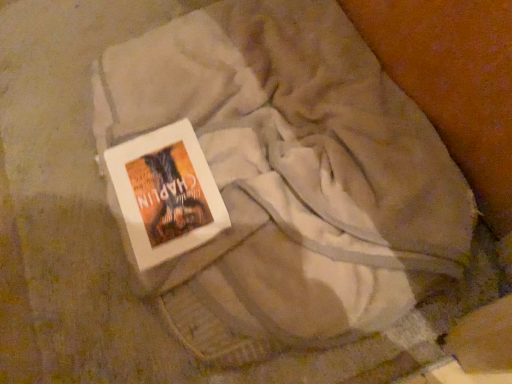
Where is `white soft blanket at center`? white soft blanket at center is located at coordinates (292, 182).

What do you see at coordinates (292, 182) in the screenshot?
I see `white soft blanket at center` at bounding box center [292, 182].

In order to face white soft blanket at center, should I rotate leftwards or rightwards?

It's best to rotate left around 0.241 degrees.

Find the location of a particular element. white paper book at center is located at coordinates (166, 193).

Describe the element at coordinates (166, 193) in the screenshot. I see `white paper book at center` at that location.

Find the location of a particular element. white soft blanket at center is located at coordinates (292, 182).

Considering the positions of objects white soft blanket at center and white paper book at center in the image provided, who is more to the left, white soft blanket at center or white paper book at center?

From the viewer's perspective, white paper book at center appears more on the left side.

Which object is more forward, white soft blanket at center or white paper book at center?

white soft blanket at center is more forward.

Is point (309, 346) closer to camera compared to point (129, 218)?

Yes.

From the image's perspective, would you say white soft blanket at center is positioned over white paper book at center?

Yes.

From a real-world perspective, is white soft blanket at center above or below white paper book at center?

Clearly, from a real-world perspective, white soft blanket at center is below white paper book at center.

Does white soft blanket at center have a greater width compared to white paper book at center?

Yes.

Looking at this image, in terms of height, does white soft blanket at center look taller or shorter compared to white paper book at center?

Clearly, white soft blanket at center is taller compared to white paper book at center.

In terms of size, does white soft blanket at center appear bigger or smaller than white paper book at center?

white soft blanket at center is bigger than white paper book at center.

Which is correct: white soft blanket at center is inside white paper book at center, or outside of it?

The correct answer is: outside.

Are white soft blanket at center and white paper book at center far apart?

No, white soft blanket at center is not far from white paper book at center.

Is white soft blanket at center oriented towards white paper book at center?

Yes, white soft blanket at center is facing white paper book at center.

What's the angular difference between white soft blanket at center and white paper book at center's facing directions?

The angle between the facing direction of white soft blanket at center and the facing direction of white paper book at center is 0.415 degrees.

The image size is (512, 384). Identify the location of textile below the white paper book at center (from a real-world perspective). (292, 182).

Is white paper book at center to the left of white soft blanket at center from the viewer's perspective?

Indeed, white paper book at center is positioned on the left side of white soft blanket at center.

Which object is closer to the camera, white paper book at center or white soft blanket at center?

white soft blanket at center is closer to the camera.

Is point (169, 239) more distant than point (266, 252)?

No, (169, 239) is closer to viewer.

From the image's perspective, is white paper book at center under white soft blanket at center?

Yes, from the image's perspective, white paper book at center is below white soft blanket at center.

From a real-world perspective, which is physically above, white paper book at center or white soft blanket at center?

In real-world perspective, white paper book at center is above.

Can you confirm if white paper book at center is thinner than white soft blanket at center?

Indeed, white paper book at center has a lesser width compared to white soft blanket at center.

Is white paper book at center shorter than white soft blanket at center?

Correct, white paper book at center is not as tall as white soft blanket at center.

Can you confirm if white paper book at center is bigger than white soft blanket at center?

Incorrect, white paper book at center is not larger than white soft blanket at center.

Do you think white paper book at center is within white soft blanket at center, or outside of it?

The correct answer is: inside.

Is white paper book at center far away from white soft blanket at center?

No, there isn't a large distance between white paper book at center and white soft blanket at center.

Does white paper book at center turn towards white soft blanket at center?

Yes, white paper book at center is aimed at white soft blanket at center.

How many degrees apart are the facing directions of white paper book at center and white soft blanket at center?

white paper book at center and white soft blanket at center are facing 0.415 degrees away from each other.

Locate an element on the screen. The width and height of the screenshot is (512, 384). textile in front of the white paper book at center is located at coordinates (292, 182).

At what (x,y) coordinates should I click in order to perform the action: click on textile that appears below the white paper book at center (from a real-world perspective). Please return your answer as a coordinate pair (x, y). Image resolution: width=512 pixels, height=384 pixels. Looking at the image, I should click on (292, 182).

Find the location of a particular element. textile on the right of the white paper book at center is located at coordinates tap(292, 182).